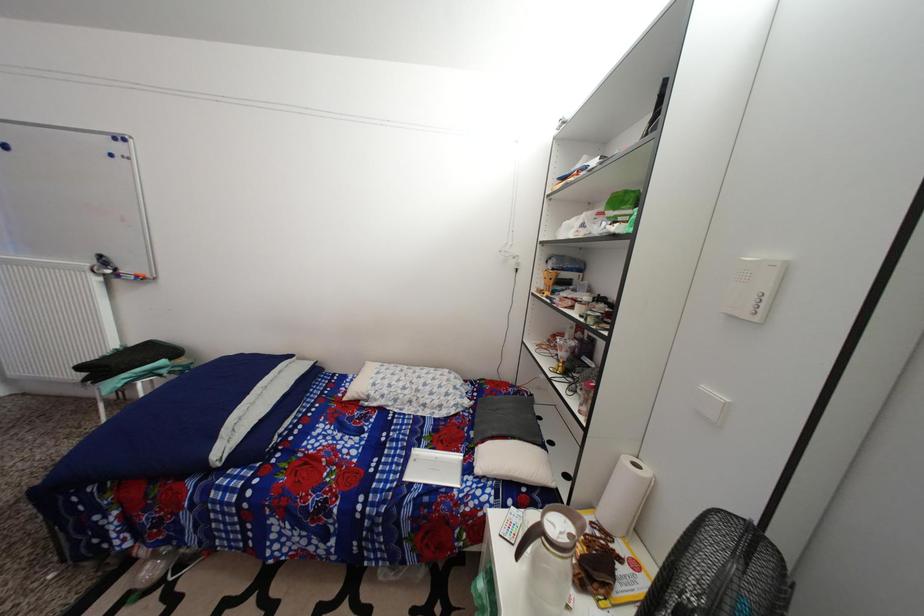
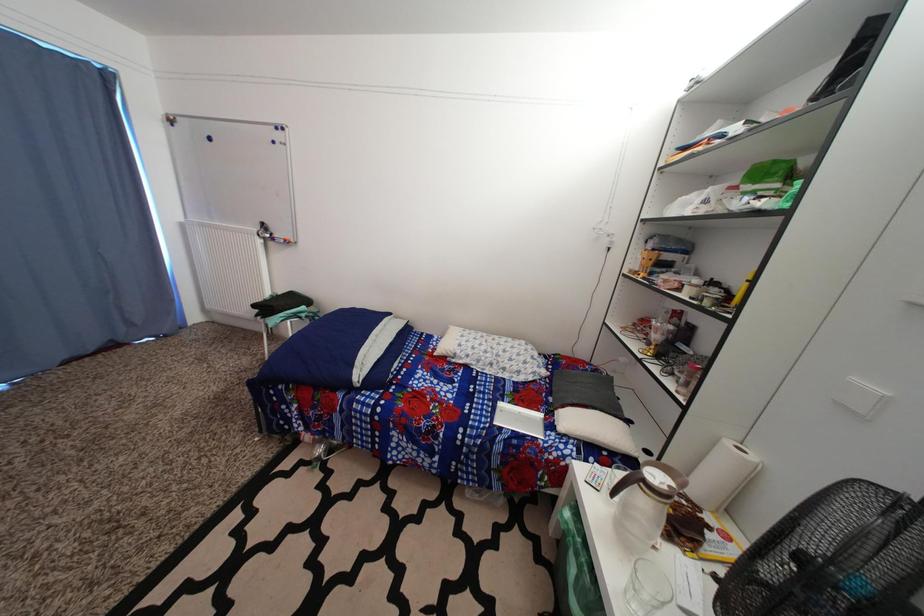
What movement of the cameraman would produce the second image?

The cameraman moved toward left, backward.